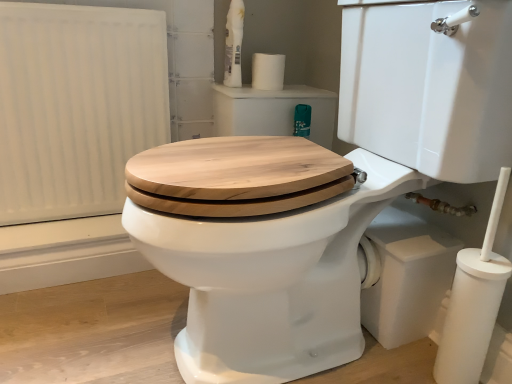
This screenshot has height=384, width=512. I want to click on free space to the right of white glossy spray bottle at upper center, so click(285, 85).